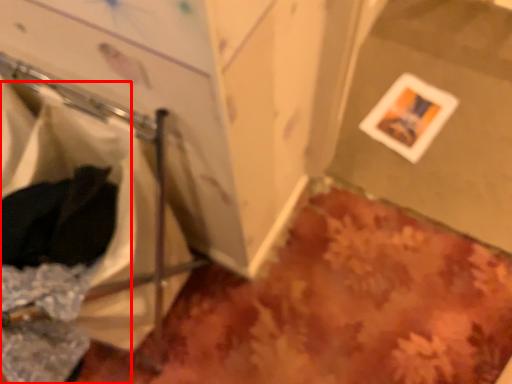
Question: From the image's perspective, where is laundry (annotated by the red box) located relative to picture frame?

Choices:
 (A) above
 (B) below

Answer: (B)